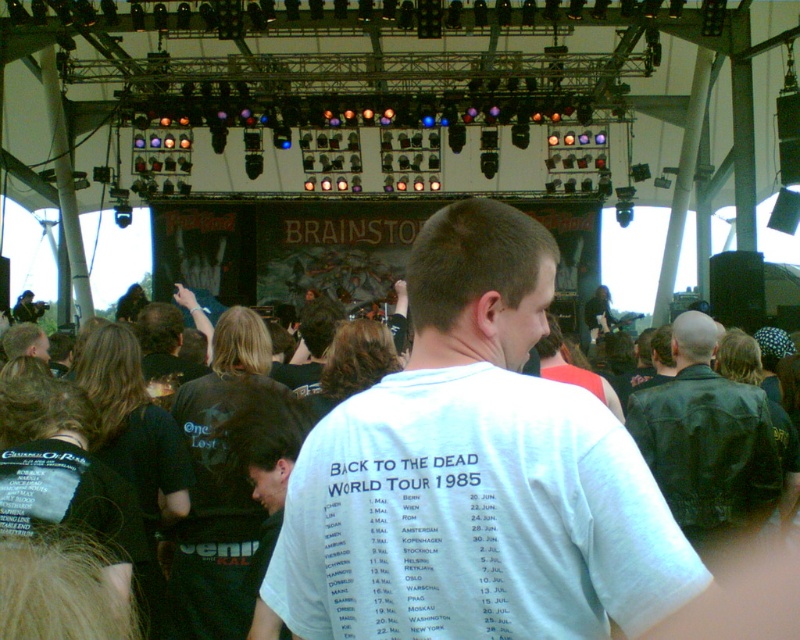
Is the position of white cotton t-shirt at center less distant than that of dark brown leather jacket at center?

Yes.

Between white cotton t-shirt at center and dark brown leather jacket at center, which one has more height?

Standing taller between the two is white cotton t-shirt at center.

Where is `white cotton t-shirt at center`? white cotton t-shirt at center is located at coordinates (476, 474).

Where is `white cotton t-shirt at center`? Image resolution: width=800 pixels, height=640 pixels. white cotton t-shirt at center is located at coordinates [x=476, y=474].

Which is more to the right, white cotton t-shirt at center or black leather jacket at right?

From the viewer's perspective, black leather jacket at right appears more on the right side.

Can you confirm if white cotton t-shirt at center is shorter than black leather jacket at right?

Incorrect, white cotton t-shirt at center's height does not fall short of black leather jacket at right's.

Describe the element at coordinates (476, 474) in the screenshot. I see `white cotton t-shirt at center` at that location.

This screenshot has width=800, height=640. I want to click on white cotton t-shirt at center, so click(476, 474).

Who is positioned more to the right, black leather jacket at right or dark brown leather jacket at center?

Positioned to the right is black leather jacket at right.

Which of these two, black leather jacket at right or dark brown leather jacket at center, stands taller?

black leather jacket at right

Is point (754, 513) positioned behind point (178, 337)?

That is False.

Identify the location of black leather jacket at right. (706, 440).